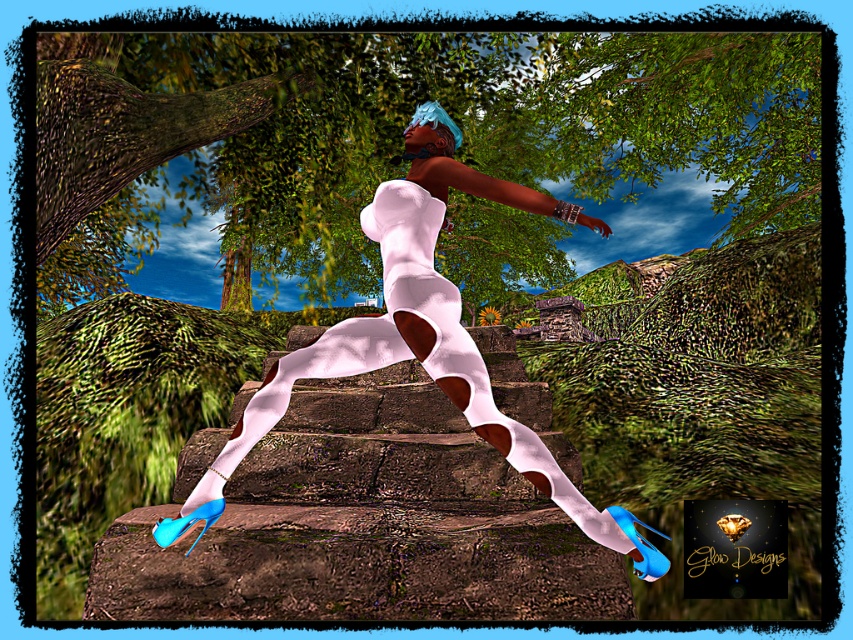
Question: Which object is the farthest from the green leafy tree at upper center?

Choices:
 (A) white matte leggings at center
 (B) matte white leggings at center

Answer: (A)

Question: Based on their relative distances, which object is farther from the white matte leggings at center?

Choices:
 (A) green leafy tree at upper center
 (B) matte white leggings at center

Answer: (A)

Question: Which point is farther to the camera?

Choices:
 (A) white matte leggings at center
 (B) green leafy tree at upper center
 (C) matte white leggings at center

Answer: (B)

Question: Where is matte white leggings at center located in relation to white matte leggings at center in the image?

Choices:
 (A) above
 (B) below

Answer: (A)

Question: Does matte white leggings at center appear on the right side of white matte leggings at center?

Choices:
 (A) no
 (B) yes

Answer: (B)

Question: Does green leafy tree at upper center appear over matte white leggings at center?

Choices:
 (A) no
 (B) yes

Answer: (B)